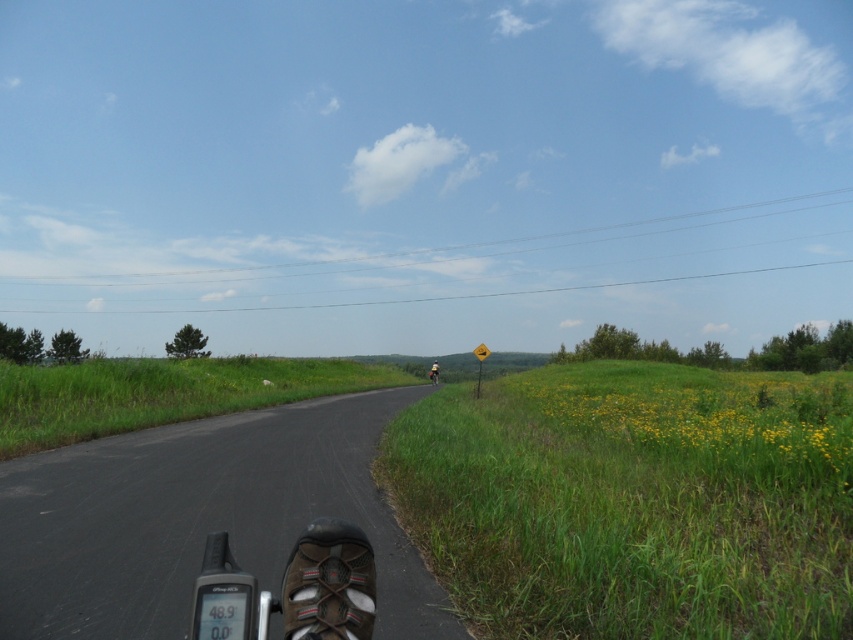
Does point (625, 624) come in front of point (474, 392)?

Yes, point (625, 624) is closer to viewer.

Is green grassy hillside at right below yellow reflective plastic sign at center?

Yes.

Who is more distant from viewer, (817,419) or (479,394)?

Point (479,394)

The height and width of the screenshot is (640, 853). In order to click on green grassy hillside at right in this screenshot , I will do `click(634, 500)`.

Does yellow reflective plastic sign at center have a greater height compared to yellow reflective vest at center?

Indeed, yellow reflective plastic sign at center has a greater height compared to yellow reflective vest at center.

Can you confirm if yellow reflective plastic sign at center is positioned above yellow reflective vest at center?

Yes.

Which is behind, point (474, 392) or point (431, 371)?

Point (431, 371)

At what (x,y) coordinates should I click in order to perform the action: click on yellow reflective plastic sign at center. Please return your answer as a coordinate pair (x, y). Image resolution: width=853 pixels, height=640 pixels. Looking at the image, I should click on (480, 362).

Who is shorter, green grassy hillside at right or yellow reflective vest at center?

green grassy hillside at right

Where is `green grassy hillside at right`? green grassy hillside at right is located at coordinates (634, 500).